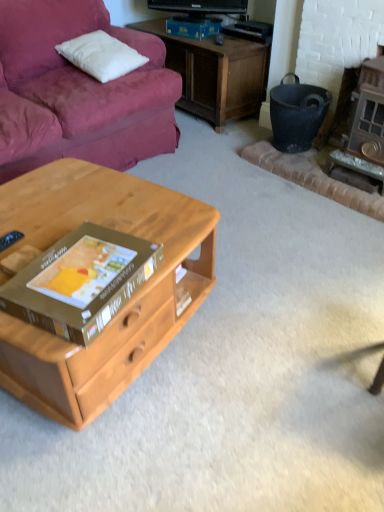
At what (x,y) coordinates should I click in order to perform the action: click on empty space that is ontop of light wood desk at center (from a real-world perspective). Please return your answer as a coordinate pair (x, y). The width and height of the screenshot is (384, 512). Looking at the image, I should click on (89, 207).